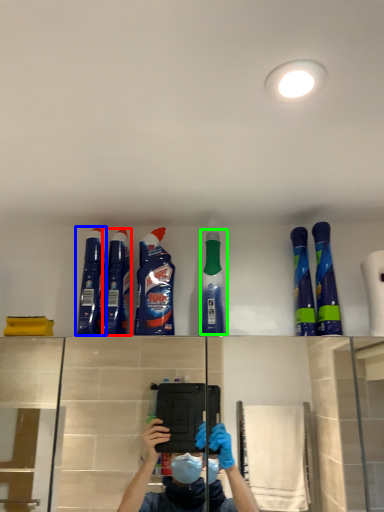
Question: Considering the real-world distances, which object is farthest from cleaning product (highlighted by a red box)? cleaning product (highlighted by a blue box) or cleaning product (highlighted by a green box)?

Choices:
 (A) cleaning product
 (B) cleaning product

Answer: (B)